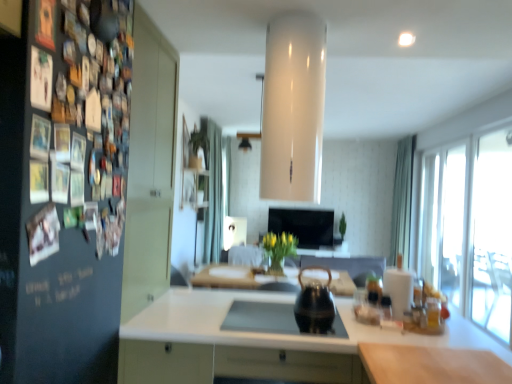
The image size is (512, 384). What are the coordinates of `free space in front of matte black tea pot at center` in the screenshot? It's located at (327, 322).